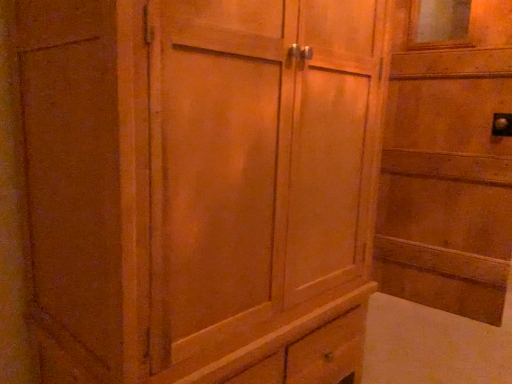
The height and width of the screenshot is (384, 512). What are the coordinates of `wooden cabinet at center` in the screenshot? It's located at (261, 181).

The image size is (512, 384). What do you see at coordinates (261, 181) in the screenshot?
I see `wooden cabinet at center` at bounding box center [261, 181].

Describe the element at coordinates (448, 161) in the screenshot. This screenshot has width=512, height=384. I see `wooden door at right` at that location.

You are a GUI agent. You are given a task and a screenshot of the screen. Output one action in this format:
    pyautogui.click(x=<x>, y=<y>)
    Task: Click on the wooden door at right
    The image size is (512, 384).
    Given the screenshot: What is the action you would take?
    pyautogui.click(x=448, y=161)

Measure the distance between point [472,28] and camera.

The distance of point [472,28] from camera is 1.94 meters.

You are a GUI agent. You are given a task and a screenshot of the screen. Output one action in this format:
    pyautogui.click(x=<x>, y=<y>)
    Task: Click on the wooden cabinet at center
    
    Given the screenshot: What is the action you would take?
    pyautogui.click(x=261, y=181)

Considering the relative positions of wooden door at right and wooden cabinet at center in the image provided, is wooden door at right to the right of wooden cabinet at center from the viewer's perspective?

Indeed, wooden door at right is positioned on the right side of wooden cabinet at center.

From the picture: Is the position of wooden door at right more distant than that of wooden cabinet at center?

That is True.

Is point (480, 87) in front of point (316, 382)?

No, it is behind (316, 382).

From the image's perspective, between wooden door at right and wooden cabinet at center, which one is located above?

wooden door at right.

From a real-world perspective, is wooden door at right over wooden cabinet at center?

Correct, in the physical world, wooden door at right is higher than wooden cabinet at center.

Considering the sizes of objects wooden door at right and wooden cabinet at center in the image provided, who is wider, wooden door at right or wooden cabinet at center?

With larger width is wooden cabinet at center.

Does wooden door at right have a lesser height compared to wooden cabinet at center?

Incorrect, the height of wooden door at right does not fall short of that of wooden cabinet at center.

Looking at this image, is wooden door at right bigger or smaller than wooden cabinet at center?

wooden door at right is smaller than wooden cabinet at center.

Is wooden cabinet at center inside wooden door at right?

No, wooden cabinet at center is located outside of wooden door at right.

Looking at this image, are wooden door at right and wooden cabinet at center making contact?

There is a gap between wooden door at right and wooden cabinet at center.

Is wooden door at right aimed at wooden cabinet at center?

Yes, wooden door at right is oriented towards wooden cabinet at center.

What's the angular difference between wooden door at right and wooden cabinet at center's facing directions?

There is a 81.9-degree angle between the facing directions of wooden door at right and wooden cabinet at center.

You are a GUI agent. You are given a task and a screenshot of the screen. Output one action in this format:
    pyautogui.click(x=<x>, y=<y>)
    Task: Click on the barn door below the wooden door at right (from a real-world perspective)
    The image size is (512, 384).
    Given the screenshot: What is the action you would take?
    pyautogui.click(x=261, y=181)

Does wooden cabinet at center appear on the right side of wooden door at right?

No, wooden cabinet at center is not to the right of wooden door at right.

In the scene shown: Is wooden cabinet at center in front of or behind wooden door at right in the image?

In the image, wooden cabinet at center appears in front of wooden door at right.

Considering the points (226, 134) and (401, 283), which point is in front, point (226, 134) or point (401, 283)?

Positioned in front is point (226, 134).

From the image's perspective, relative to wooden door at right, is wooden cabinet at center above or below?

Based on their image positions, wooden cabinet at center is located beneath wooden door at right.

From a real-world perspective, is wooden cabinet at center positioned under wooden door at right based on gravity?

Yes, from a real-world perspective, wooden cabinet at center is below wooden door at right.

Between wooden cabinet at center and wooden door at right, which one has smaller width?

Thinner between the two is wooden door at right.

Who is shorter, wooden cabinet at center or wooden door at right?

wooden cabinet at center.

Who is smaller, wooden cabinet at center or wooden door at right?

Smaller between the two is wooden door at right.

From the picture: Is wooden cabinet at center situated inside wooden door at right or outside?

wooden cabinet at center is not enclosed by wooden door at right.

Is wooden cabinet at center not near wooden door at right?

Yes, wooden cabinet at center and wooden door at right are located far from each other.

Is wooden cabinet at center positioned with its back to wooden door at right?

No, wooden cabinet at center is not facing away from wooden door at right.

There is a wooden cabinet at center. Identify the location of elevator above it (from a real-world perspective). The image size is (512, 384). (448, 161).

Image resolution: width=512 pixels, height=384 pixels. Find the location of `barn door lying below the wooden door at right (from the image's perspective)`. barn door lying below the wooden door at right (from the image's perspective) is located at coordinates point(261,181).

The width and height of the screenshot is (512, 384). What are the coordinates of `elevator behind the wooden cabinet at center` in the screenshot? It's located at (448, 161).